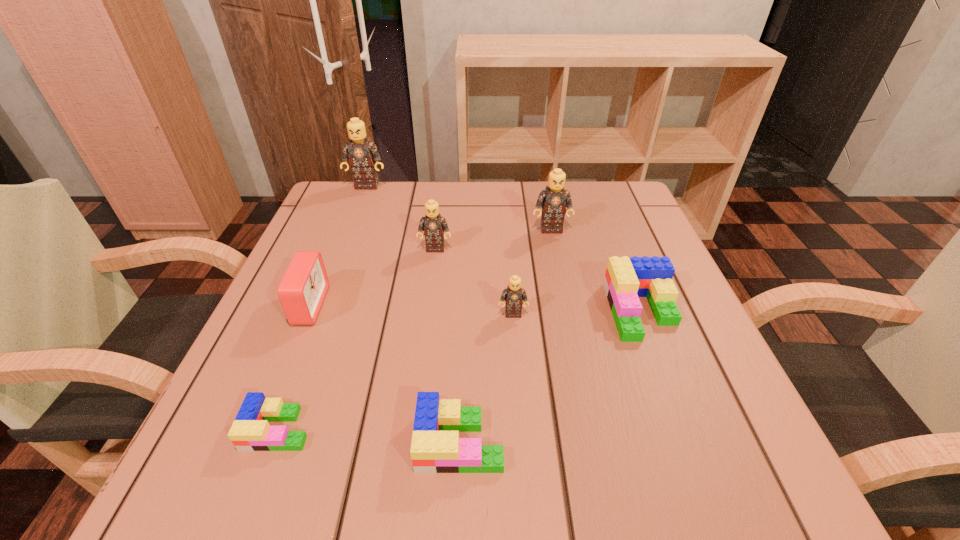
What are the coordinates of `the biggest green Lego` in the screenshot? It's located at (626, 279).

In order to click on the second green Lego from left to right in this screenshot , I will do `click(436, 447)`.

The width and height of the screenshot is (960, 540). I want to click on the sixth tallest Lego, so 436,447.

The height and width of the screenshot is (540, 960). In order to click on the leftmost green Lego in this screenshot , I will do `click(250, 431)`.

Find the location of a particular element. Image resolution: width=960 pixels, height=540 pixels. the shortest Lego is located at coordinates (250, 431).

The width and height of the screenshot is (960, 540). What are the coordinates of `free space located 0.320m in front of the farthest tan Lego` in the screenshot? It's located at (335, 268).

The height and width of the screenshot is (540, 960). Find the location of `vacant position located 0.160m in front of the second biggest tan Lego`. vacant position located 0.160m in front of the second biggest tan Lego is located at coordinates (562, 280).

You are a GUI agent. You are given a task and a screenshot of the screen. Output one action in this format:
    pyautogui.click(x=<x>, y=<y>)
    Task: Click on the vacant space located 0.290m in front of the sixth nearest object
    The width and height of the screenshot is (960, 540).
    Given the screenshot: What is the action you would take?
    pyautogui.click(x=421, y=360)

This screenshot has height=540, width=960. In order to click on vacant space situated on the front-facing side of the red alarm clock in this screenshot , I will do `click(536, 306)`.

Image resolution: width=960 pixels, height=540 pixels. I want to click on free region located in front of the smallest tan Lego, so click(522, 434).